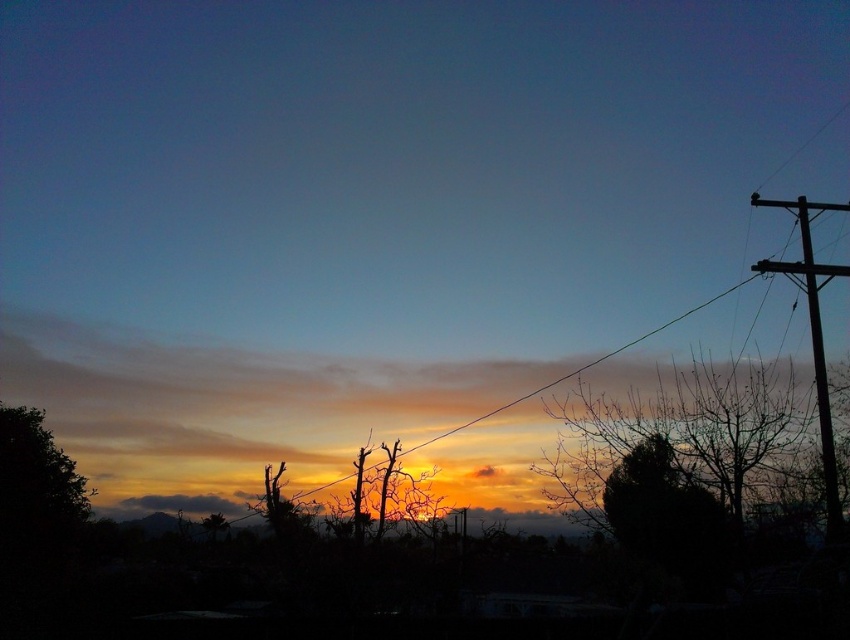
Which is more to the right, dark green leafy tree at lower left or brown wooden telegraph pole at right?

Positioned to the right is brown wooden telegraph pole at right.

Looking at this image, can you confirm if dark green leafy tree at lower left is wider than brown wooden telegraph pole at right?

Yes, dark green leafy tree at lower left is wider than brown wooden telegraph pole at right.

Is point (10, 426) positioned before point (820, 410)?

That is False.

What are the coordinates of `dark green leafy tree at lower left` in the screenshot? It's located at (37, 483).

Is dark green leafy tree at lower left smaller than green wire at center?

Indeed, dark green leafy tree at lower left has a smaller size compared to green wire at center.

Who is lower down, dark green leafy tree at lower left or green wire at center?

Positioned lower is dark green leafy tree at lower left.

The height and width of the screenshot is (640, 850). Find the location of `dark green leafy tree at lower left`. dark green leafy tree at lower left is located at coordinates (37, 483).

The width and height of the screenshot is (850, 640). Identify the location of dark green leafy tree at lower left. (37, 483).

Is silhouette leafless at right smaller than green wire at center?

Yes, silhouette leafless at right is smaller than green wire at center.

You are a GUI agent. You are given a task and a screenshot of the screen. Output one action in this format:
    pyautogui.click(x=<x>, y=<y>)
    Task: Click on the silhouette leafless at right
    
    Given the screenshot: What is the action you would take?
    pyautogui.click(x=687, y=435)

What do you see at coordinates (687, 435) in the screenshot?
I see `silhouette leafless at right` at bounding box center [687, 435].

Where is `silhouette leafless at right`? The height and width of the screenshot is (640, 850). silhouette leafless at right is located at coordinates (687, 435).